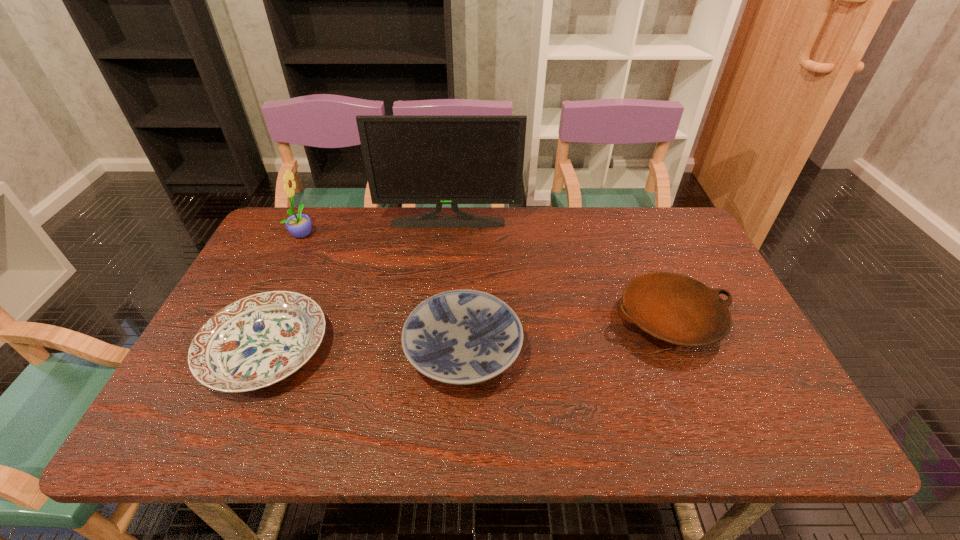
The width and height of the screenshot is (960, 540). In order to click on blank region between the second plate from right to left and the leftmost plate in this screenshot , I will do `click(365, 350)`.

At what (x,y) coordinates should I click in order to perform the action: click on unoccupied position between the rightmost plate and the sunflower. Please return your answer as a coordinate pair (x, y). This screenshot has width=960, height=540. Looking at the image, I should click on (487, 276).

You are a GUI agent. You are given a task and a screenshot of the screen. Output one action in this format:
    pyautogui.click(x=<x>, y=<y>)
    Task: Click on the empty space between the second plate from right to left and the leftmost plate
    The image size is (960, 540).
    Given the screenshot: What is the action you would take?
    pyautogui.click(x=365, y=350)

Find the location of a particular element. Image resolution: width=960 pixels, height=540 pixels. free space between the fourth shortest object and the monitor is located at coordinates (375, 228).

At what (x,y) coordinates should I click in order to perform the action: click on vacant area between the sunflower and the rightmost object. Please return your answer as a coordinate pair (x, y). Looking at the image, I should click on (487, 276).

The width and height of the screenshot is (960, 540). I want to click on vacant area between the tallest object and the shortest plate, so click(357, 286).

I want to click on vacant area that lies between the shortest object and the second plate from right to left, so click(365, 350).

Point out which object is positioned as the third nearest to the second tallest object. Please provide its 2D coordinates. Your answer should be formatted as a tuple, i.e. [(x, y)], where the tuple contains the x and y coordinates of a point satisfying the conditions above.

[(460, 337)]

Select which object is the second closest to the fourth shortest object. Please provide its 2D coordinates. Your answer should be formatted as a tuple, i.e. [(x, y)], where the tuple contains the x and y coordinates of a point satisfying the conditions above.

[(259, 340)]

Image resolution: width=960 pixels, height=540 pixels. I want to click on the closest plate to the monitor, so click(x=674, y=308).